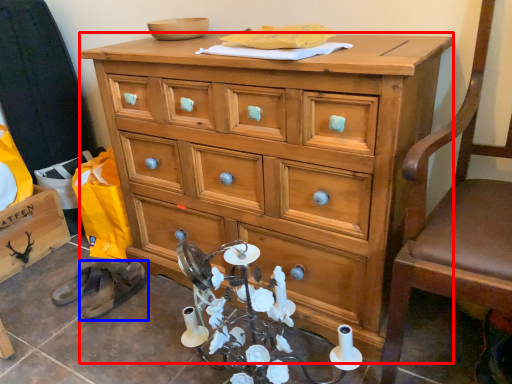
Question: Which object is further to the camera taking this photo, chest of drawers (highlighted by a red box) or footwear (highlighted by a blue box)?

Choices:
 (A) chest of drawers
 (B) footwear

Answer: (B)